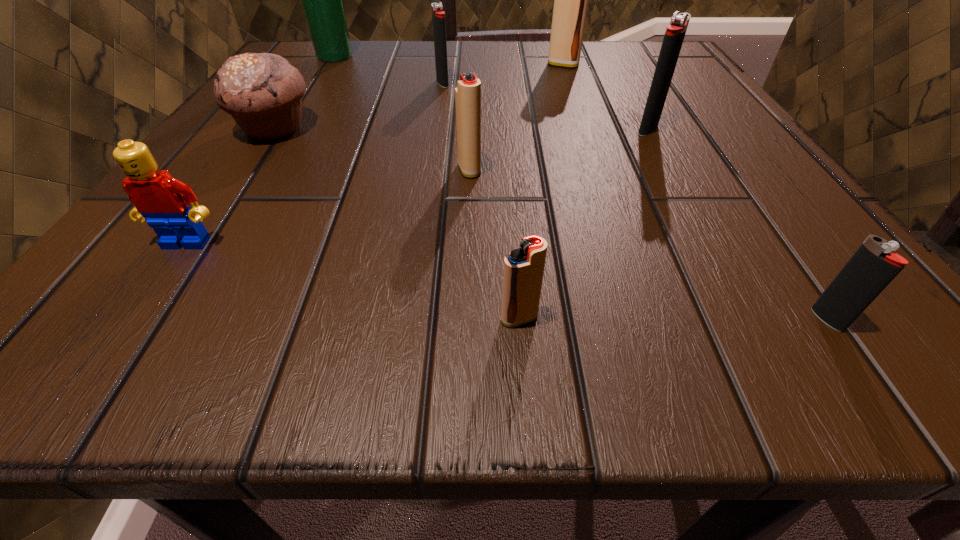
Locate an element on the screen. This screenshot has width=960, height=540. bottle is located at coordinates (322, 0).

Where is `the tallest object`? This screenshot has height=540, width=960. the tallest object is located at coordinates (322, 0).

This screenshot has width=960, height=540. Find the location of `the rightmost red igniter`. the rightmost red igniter is located at coordinates pos(571,0).

This screenshot has width=960, height=540. Identify the location of the biggest red igniter. (571, 0).

The image size is (960, 540). In order to click on the second black igniter from left to right in this screenshot , I will do `click(674, 36)`.

This screenshot has width=960, height=540. I want to click on the eighth object from left to right, so click(674, 36).

Find the location of a particular element. The width and height of the screenshot is (960, 540). the second smallest black igniter is located at coordinates (438, 15).

Identify the location of the seventh nearest object. (438, 15).

Find the location of `the fifth igniter from right to left`. the fifth igniter from right to left is located at coordinates (468, 90).

Find the location of a particular element. The image size is (960, 540). the fourth farthest igniter is located at coordinates (468, 90).